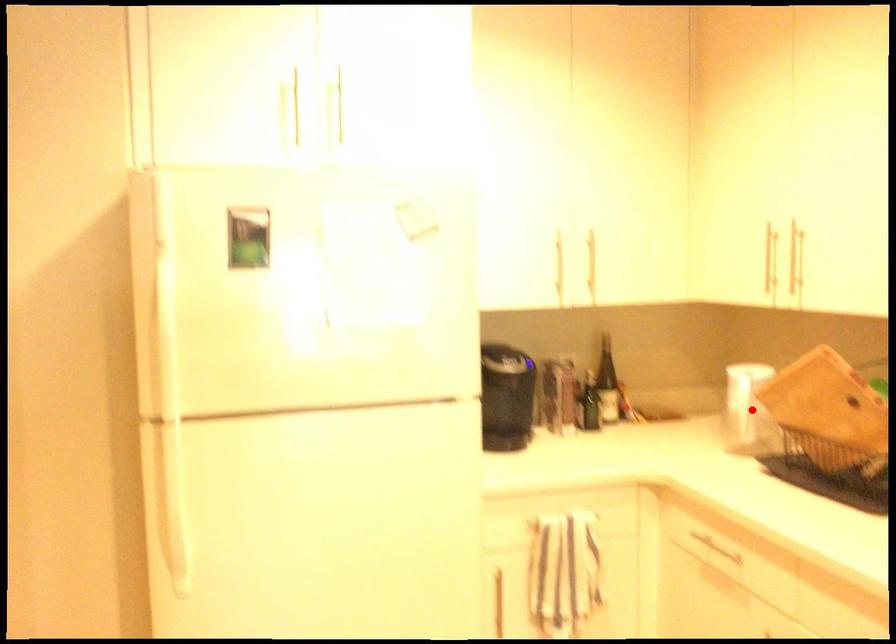
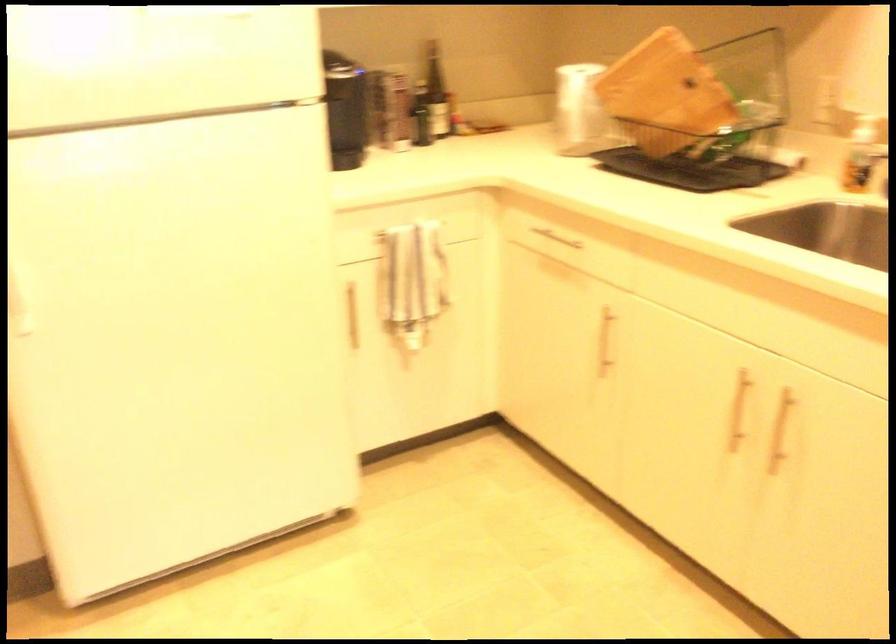
Locate, in the second image, the point that corresponds to the highlighted location in the first image.

(579, 108)